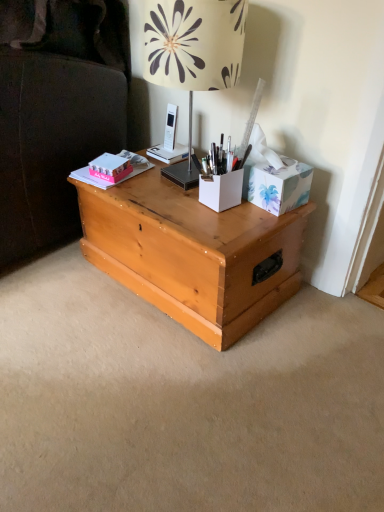
In order to click on vacant area in front of white matte pen holder at center, the first cardboard box in the left-to-right sequence in this screenshot , I will do `click(227, 225)`.